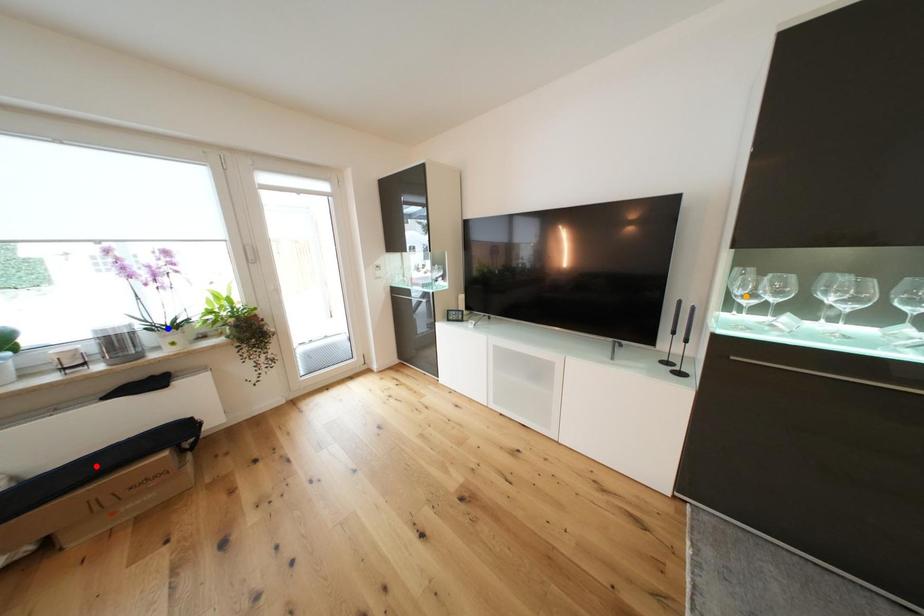
Order these from nearest to farthest:
orange point | blue point | red point

blue point → orange point → red point